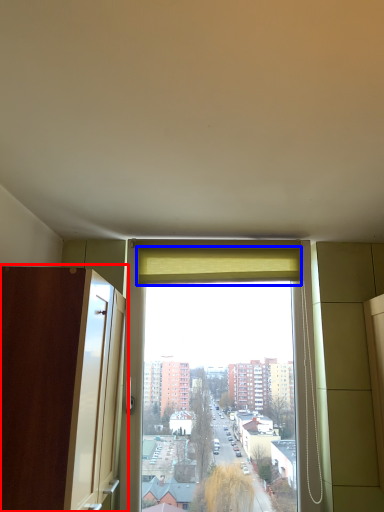
Question: Which point is further to the camera, screen door (highlighted by a red box) or curtain (highlighted by a blue box)?

Choices:
 (A) screen door
 (B) curtain

Answer: (B)